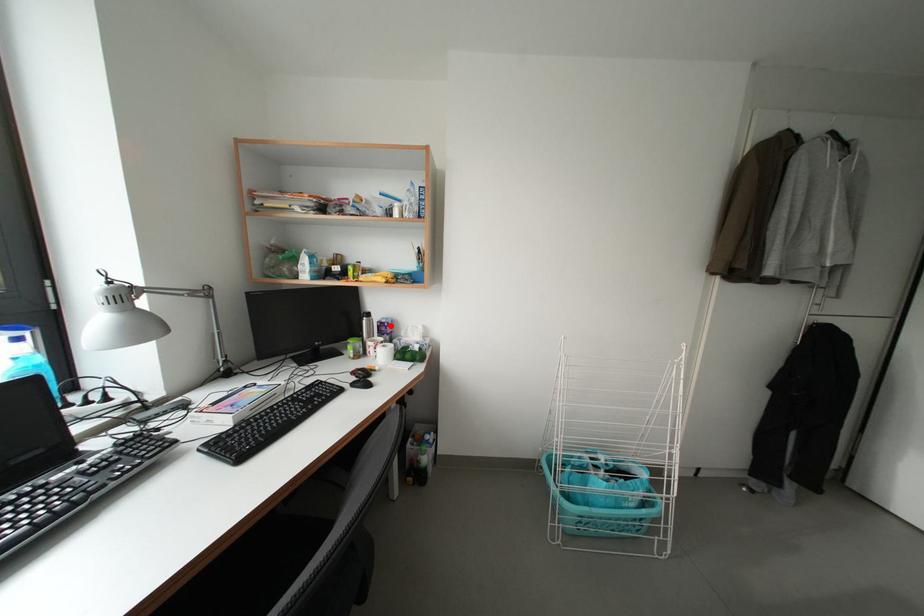
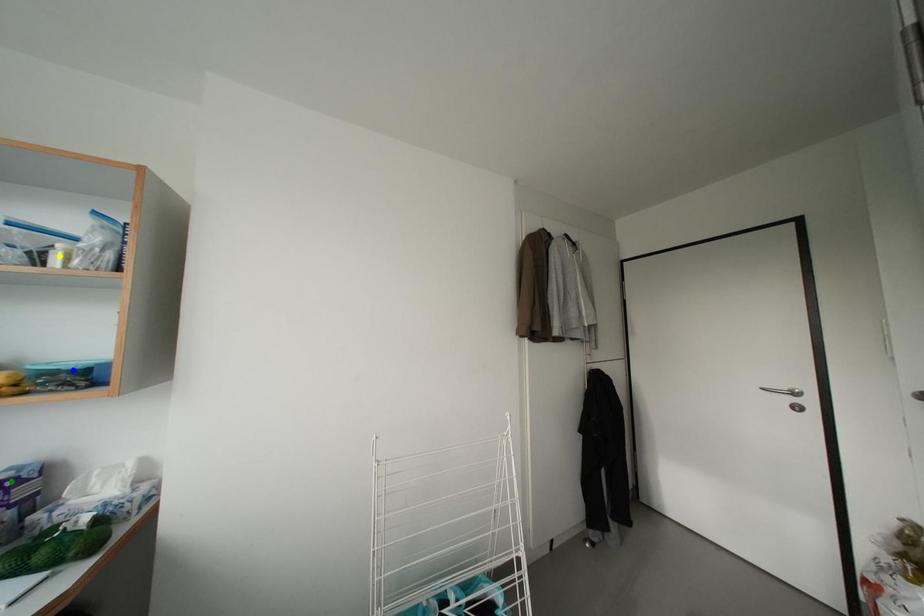
Question: I am providing you with two images of the same scene from different viewpoints. A red point is marked on the first image. You are given multiple points on the second image. Which spot in image 2 lines up with the point in image 1?

Choices:
 (A) green point
 (B) blue point
 (C) yellow point

Answer: (A)